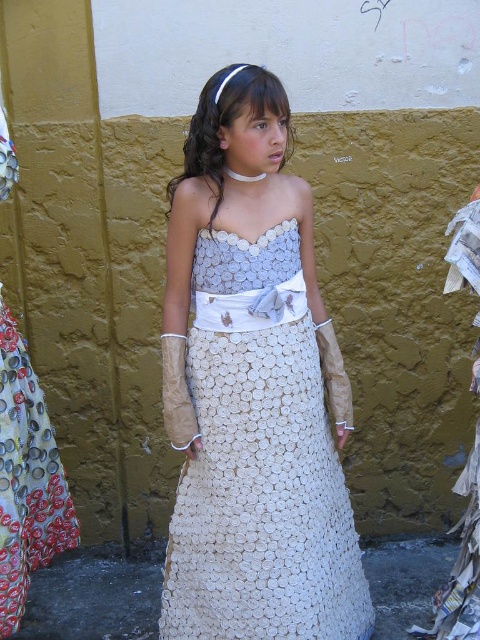
You are a fashion designer observing the girl in the image. You notice two versions of her dress labeled as white textured dress at center and white textured fabric dress at center. Which dress is wider?

The white textured dress at center is wider than the white textured fabric dress at center.

Consider the image. Based on the scene description, where is the white textured dress located? Please provide coordinates in the format of a point like point (252, 388).

The white textured dress at center is located at point (252, 388).